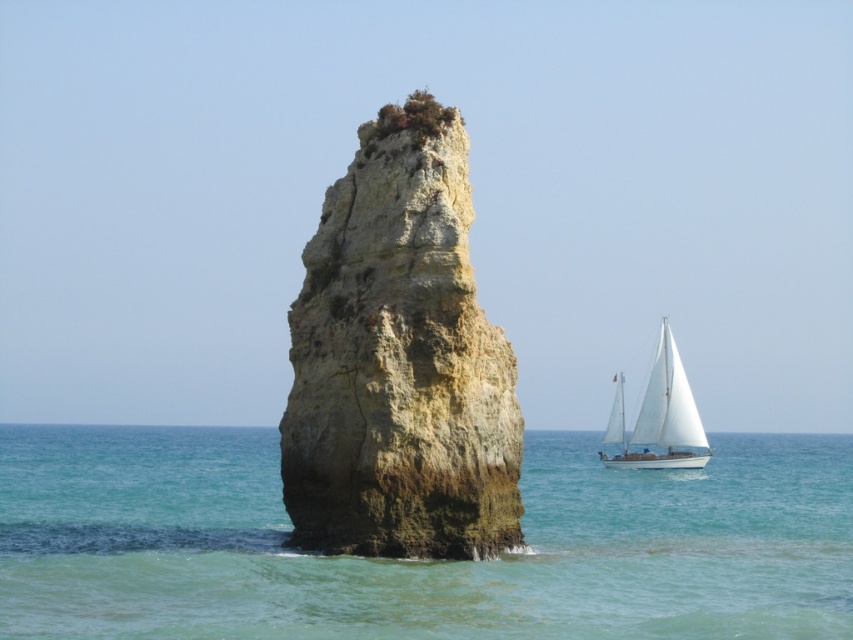
You are standing on a cliff overlooking the coastal scene. You see the clear blue water at center and the white sailboat at right. Which object is closer to you?

The clear blue water at center is closer to you because it is in front of the white sailboat at right.

You are standing at the shore looking at the large rock formation and the sailboat. If you want to reach the point marked at coordinates point [640,522], which object is closer to you? The point is 108.99 meters away. The sailboat is 120 meters away. The rock formation is 50 meters away. Which object is closest to you?

The rock formation is closest to you at 50 meters, followed by the point at 108.99 meters, and the sailboat at 120 meters.

You are standing on the beach and looking at the rough stone rock at center and the white sailboat at right. Which object is nearer to you?

The rough stone rock at center is closer to the viewer than the white sailboat at right, so the rough stone rock at center is nearer to you.